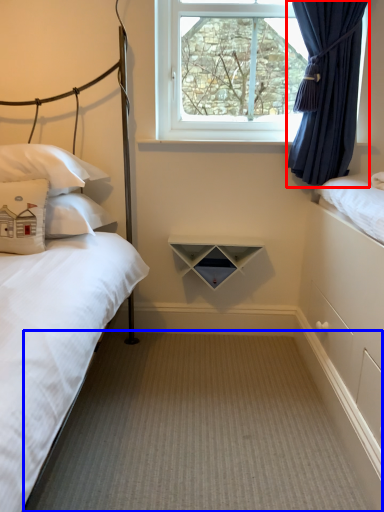
Question: Which point is closer to the camera, curtain (highlighted by a red box) or plain (highlighted by a blue box)?

Choices:
 (A) curtain
 (B) plain

Answer: (B)